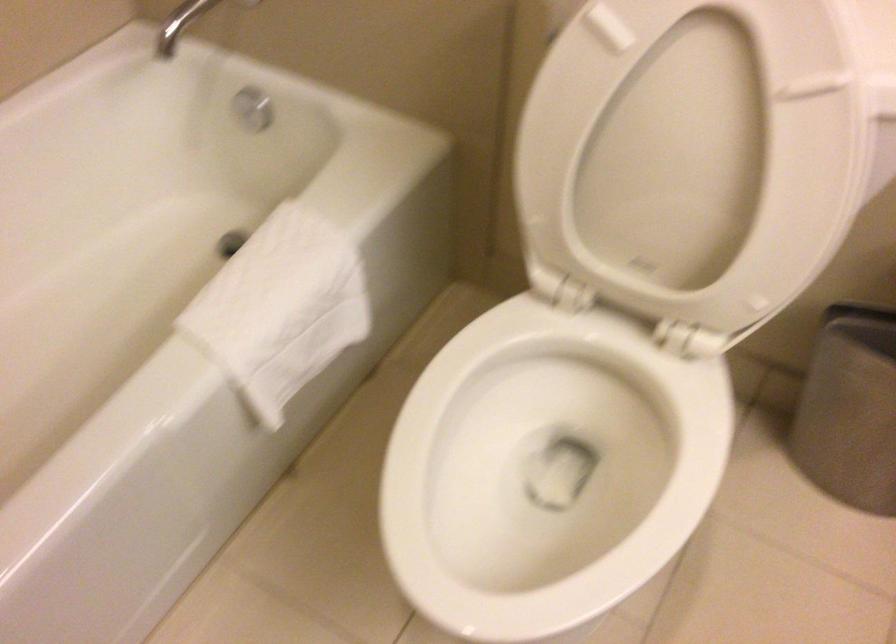
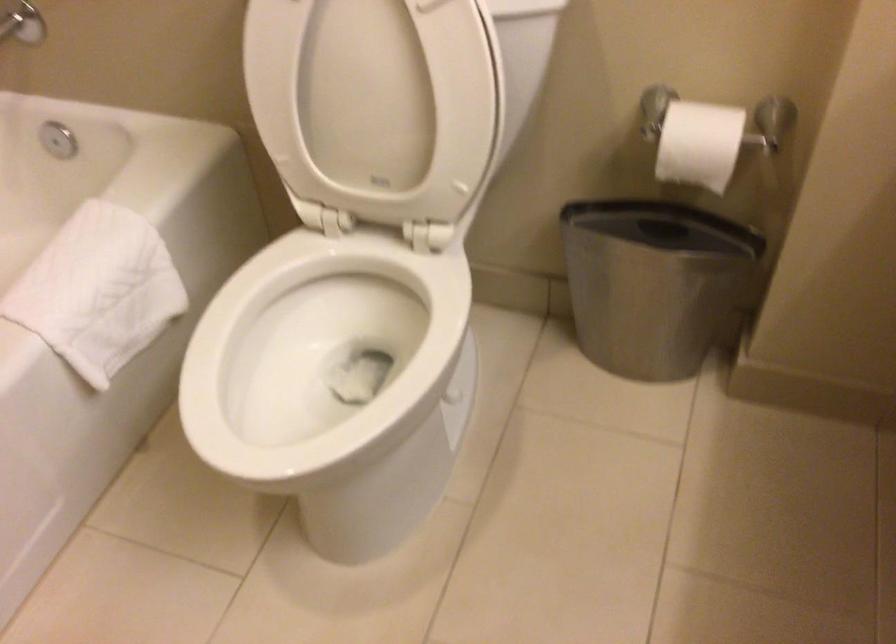
In a continuous first-person perspective shot, in which direction is the camera moving?

The cameraman walked toward right, backward.